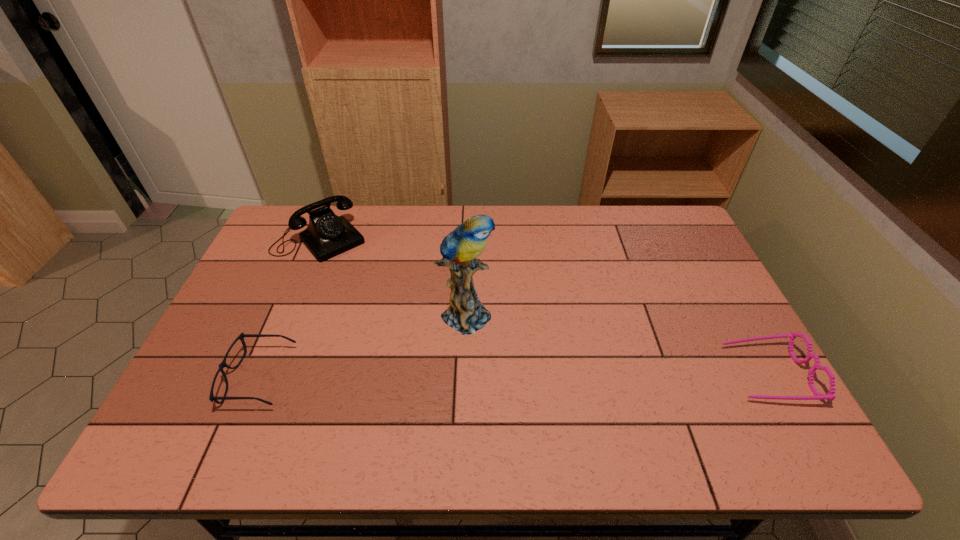
At what (x,y) coordinates should I click in order to perform the action: click on empty space between the second farthest object and the right spectacles. Please return your answer as a coordinate pair (x, y). Looking at the image, I should click on (616, 343).

Point out which object is positioned as the second nearest to the shortest object. Please provide its 2D coordinates. Your answer should be formatted as a tuple, i.e. [(x, y)], where the tuple contains the x and y coordinates of a point satisfying the conditions above.

[(466, 314)]

Where is `the second closest object to the left spectacles`? The width and height of the screenshot is (960, 540). the second closest object to the left spectacles is located at coordinates (466, 314).

Find the location of a particular element. vacant position in the image that satisfies the following two spatial constraints: 1. on the front side of the second farthest object; 2. on the arms of the third tallest object is located at coordinates (465, 374).

Identify the location of vacant space that satisfies the following two spatial constraints: 1. on the front side of the taller spectacles; 2. on the arms of the telephone. The image size is (960, 540). (265, 374).